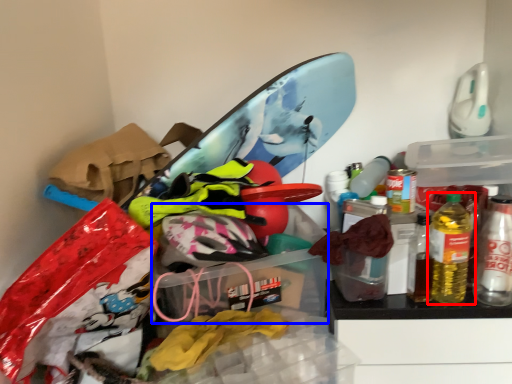
Question: Which object is closer to the camera taking this photo, bottle (highlighted by a red box) or storage box (highlighted by a blue box)?

Choices:
 (A) bottle
 (B) storage box

Answer: (B)